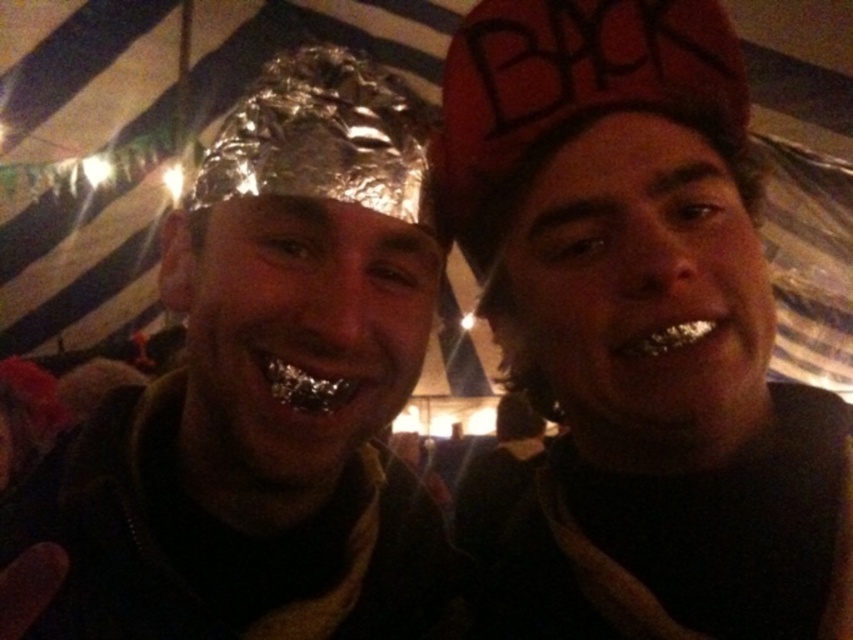
You are a photographer trying to capture a clear photo of both the red fabric cap at right and the metallic silver teeth at lower right. Since the camera can only focus on one object at a time, which object should you choose to ensure the other remains somewhat in focus?

The red fabric cap at right is closer to the viewer than the metallic silver teeth at lower right. To ensure the other object remains somewhat in focus, you should focus on the red fabric cap at right because it is closer, and the metallic silver teeth at lower right will be slightly out of focus but still recognizable.

You are a photographer taking a picture of the two people in the scene. You need to adjust your camera settings to focus on both the red fabric cap at right and the metallic silver teeth at lower right. Which object should you focus on first to ensure proper focus, considering their sizes?

The red fabric cap at right is larger in size than the metallic silver teeth at lower right, so you should focus on the red fabric cap at right first to ensure proper focus since larger objects often require more precise focus adjustments.

You are a photographer adjusting the camera to capture a closeup of the shiny metallic foil at center and metallic silver teeth at lower right. The camera requires at least 10 inches of space between objects to focus properly. Based on the scene, will the camera be able to focus on both objects simultaneously?

The shiny metallic foil at center is only 8.90 inches from metallic silver teeth at lower right, which is less than the required 10 inches. Therefore, the camera may struggle to focus on both objects simultaneously due to insufficient spacing.